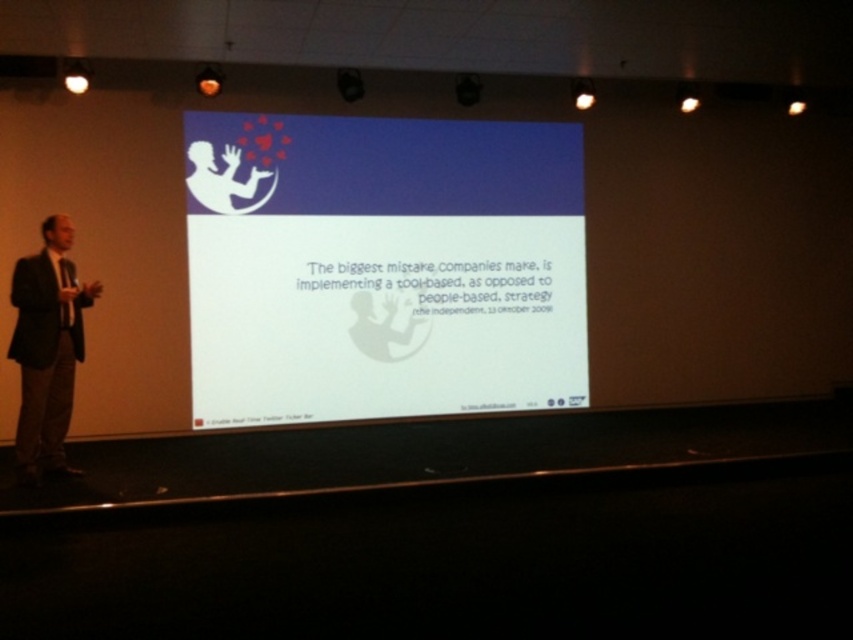
Question: Is white matte projection screen at center positioned before dark suit at left?

Choices:
 (A) no
 (B) yes

Answer: (A)

Question: Which point is farther to the camera?

Choices:
 (A) white matte projection screen at center
 (B) dark suit at left

Answer: (A)

Question: Among these points, which one is farthest from the camera?

Choices:
 (A) (479, 141)
 (B) (33, 371)

Answer: (A)

Question: Is white matte projection screen at center closer to the viewer compared to dark suit at left?

Choices:
 (A) yes
 (B) no

Answer: (B)

Question: Does white matte projection screen at center have a larger size compared to dark suit at left?

Choices:
 (A) yes
 (B) no

Answer: (A)